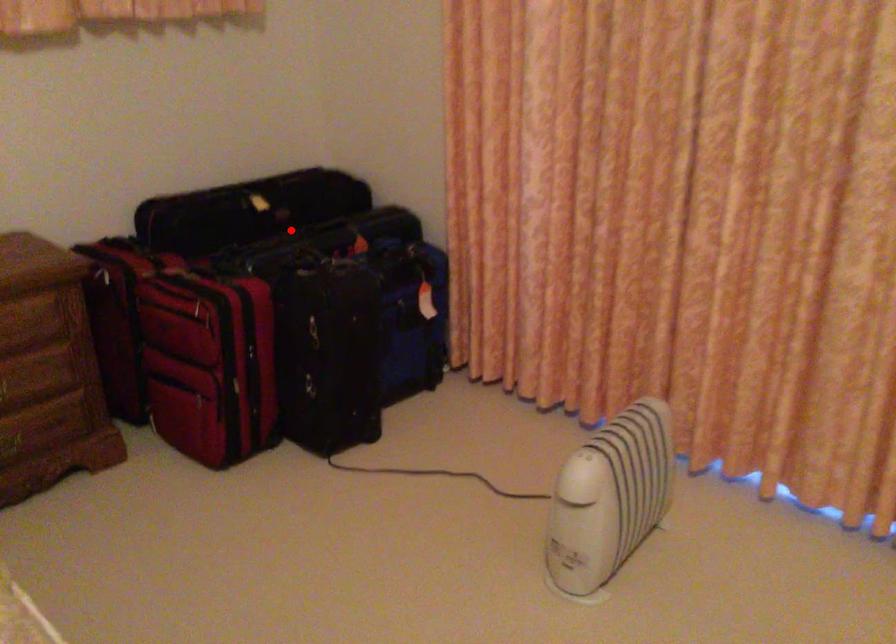
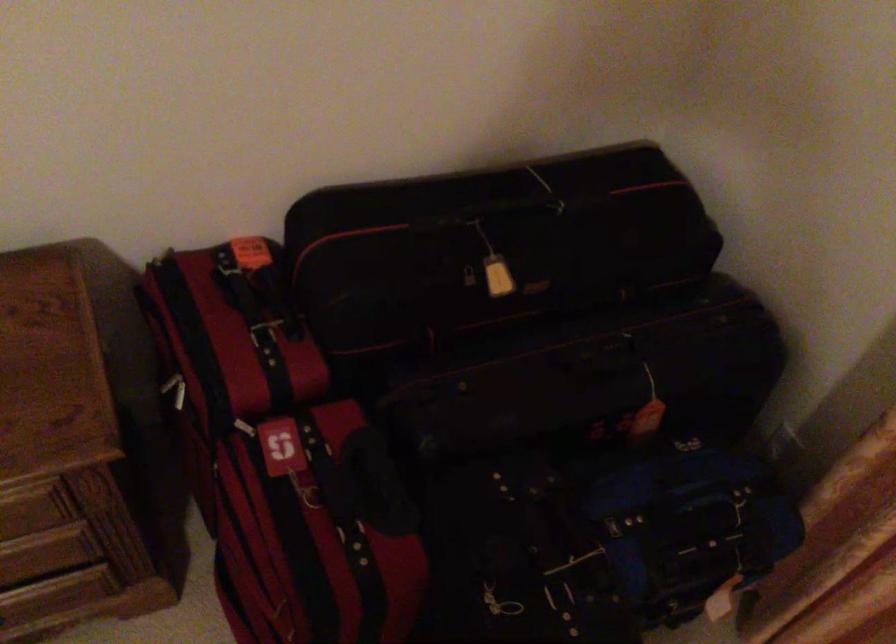
Question: I am providing you with two images of the same scene from different viewpoints. In image1, a red point is highlighted. Considering the same 3D point in image2, which of the following is correct?

Choices:
 (A) It is closer
 (B) It is farther

Answer: (A)